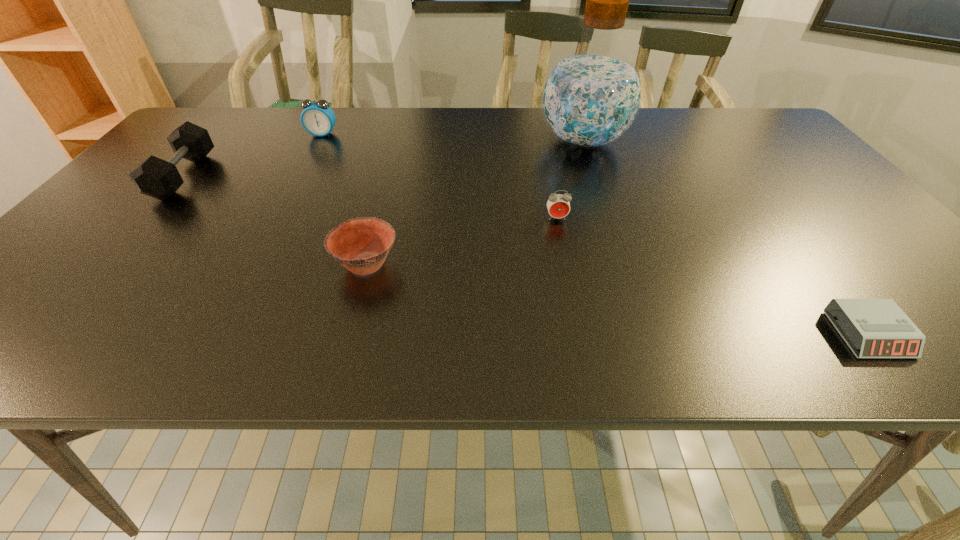
Find the location of a particular element. The width and height of the screenshot is (960, 540). the tallest object is located at coordinates (591, 96).

The image size is (960, 540). In order to click on the leftmost alarm clock in this screenshot , I will do `click(317, 118)`.

The image size is (960, 540). I want to click on the tallest alarm clock, so click(x=317, y=118).

Where is `the leftmost object`? Image resolution: width=960 pixels, height=540 pixels. the leftmost object is located at coordinates (154, 177).

Find the location of a particular element. The width and height of the screenshot is (960, 540). the second alarm clock from left to right is located at coordinates (558, 205).

This screenshot has width=960, height=540. I want to click on the second shortest alarm clock, so click(558, 205).

This screenshot has width=960, height=540. Identify the location of bowl. (361, 245).

The image size is (960, 540). In order to click on the fifth farthest object in this screenshot , I will do `click(361, 245)`.

In order to click on the shortest alarm clock in this screenshot , I will do `click(878, 328)`.

You are a GUI agent. You are given a task and a screenshot of the screen. Output one action in this format:
    pyautogui.click(x=<x>, y=<y>)
    Task: Click on the rightmost alarm clock
    Image resolution: width=960 pixels, height=540 pixels.
    Given the screenshot: What is the action you would take?
    pyautogui.click(x=878, y=328)